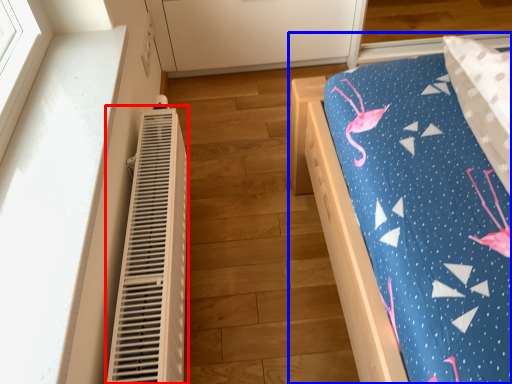
Question: Which of the following is the farthest to the observer, heater (highlighted by a red box) or furniture (highlighted by a blue box)?

Choices:
 (A) heater
 (B) furniture

Answer: (B)